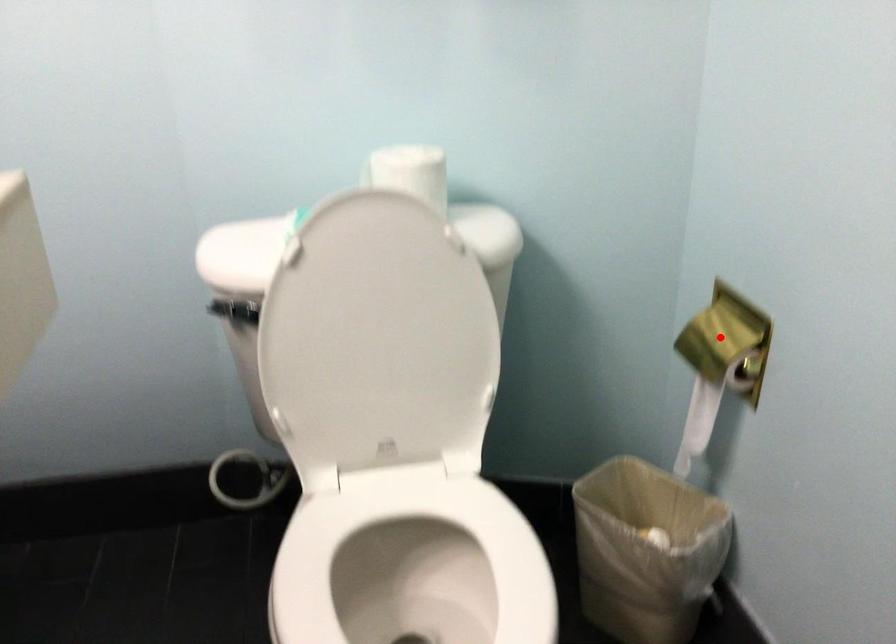
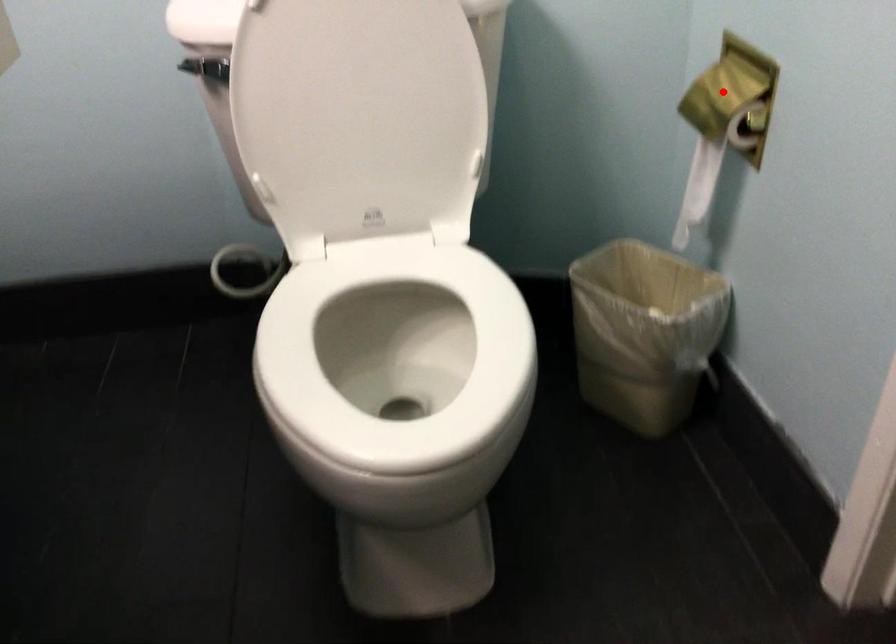
I am providing you with two images of the same scene from different viewpoints. A red point is marked on the first image and another point is marked on the second image. Do the highlighted points in image1 and image2 indicate the same real-world spot?

Yes